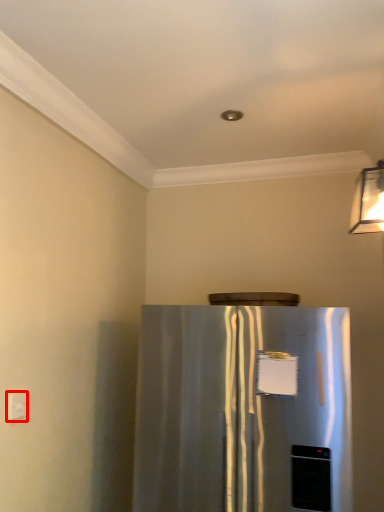
Question: Considering the relative positions of electric outlet (annotated by the red box) and refrigerator in the image provided, where is electric outlet (annotated by the red box) located with respect to the staircase?

Choices:
 (A) right
 (B) left

Answer: (B)